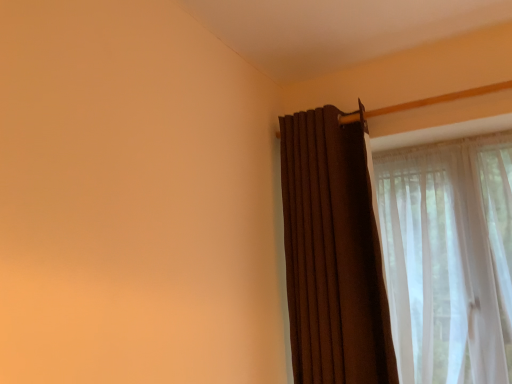
What do you see at coordinates (395, 255) in the screenshot? The width and height of the screenshot is (512, 384). I see `brown textured curtain at right` at bounding box center [395, 255].

This screenshot has height=384, width=512. What are the coordinates of `brown textured curtain at right` in the screenshot? It's located at (395, 255).

Find the location of `brown textured curtain at right`. brown textured curtain at right is located at coordinates (395, 255).